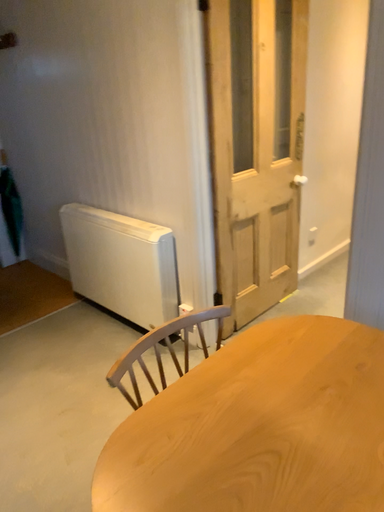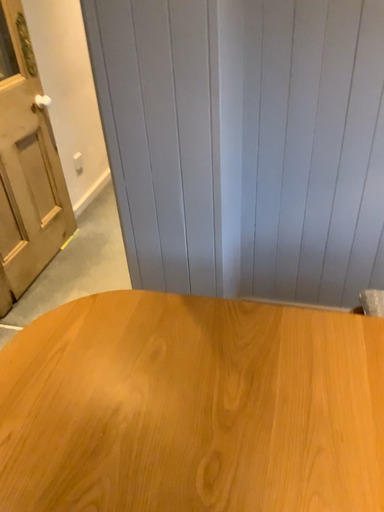
Question: How did the camera likely rotate when shooting the video?

Choices:
 (A) rotated left
 (B) rotated right

Answer: (B)